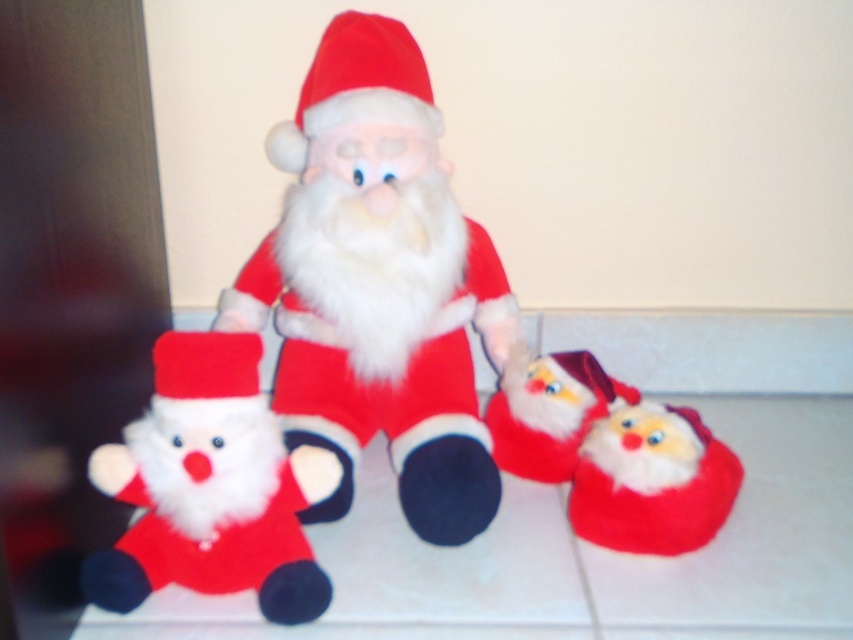
You are organizing a holiday display and need to place a decorative wreath between the velvety red santa at center and the matte fabric santa hat at center. Based on their positions, which object should the wreath be placed to the left of?

The wreath should be placed to the left of the matte fabric santa hat at center because the velvety red santa at center is positioned on the right side of the matte fabric santa hat at center.

You are organizing a holiday display and need to place a decorative box between the velvety red santa at center and the fuzzy red santa hat at lower right. Based on their sizes, which object should the box be placed closer to?

The velvety red santa at center is wider than the fuzzy red santa hat at lower right. Therefore, the box should be placed closer to the fuzzy red santa hat at lower right to ensure proper spacing between the two objects.

You are standing at the origin point of the coordinate system in the image. The image has a coordinate system where the bottom left corner is the origin. You want to place a new plush toy exactly 0.1 units to the right and 0.1 units above the velvety red santa at center. What are the coordinates of the spot where you should place the new plush toy?

The coordinates of the velvety red santa at center are given as point (378, 284). Adding 0.1 units to the x and y coordinates, the new coordinates would be (463, 348). Therefore, you should place the new plush toy at coordinates (463, 348).